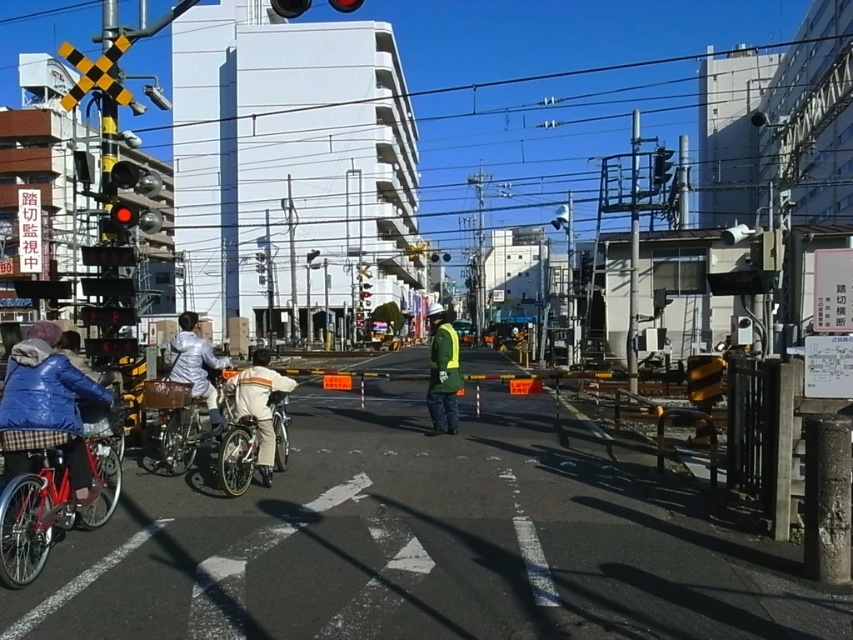
Find the location of a particular element. metallic silver bicycle at center is located at coordinates (236, 451).

Does metallic silver bicycle at center appear on the left side of silver metallic bicycle at left?

No, metallic silver bicycle at center is not to the left of silver metallic bicycle at left.

Does point (247, 465) come closer to viewer compared to point (183, 378)?

Yes, it is in front of point (183, 378).

Image resolution: width=853 pixels, height=640 pixels. I want to click on metallic silver bicycle at center, so click(236, 451).

Who is taller, metallic silver bicycle at center or blue glass traffic light at upper center?

blue glass traffic light at upper center

Who is more forward, (x=248, y=444) or (x=358, y=4)?

Positioned in front is point (x=248, y=444).

The height and width of the screenshot is (640, 853). I want to click on metallic silver bicycle at center, so click(236, 451).

Does point (434, 396) come in front of point (360, 3)?

No.

At what (x,y) coordinates should I click in order to perform the action: click on reflective yellow vest at center. Please return your answer as a coordinate pair (x, y). Looking at the image, I should click on (442, 372).